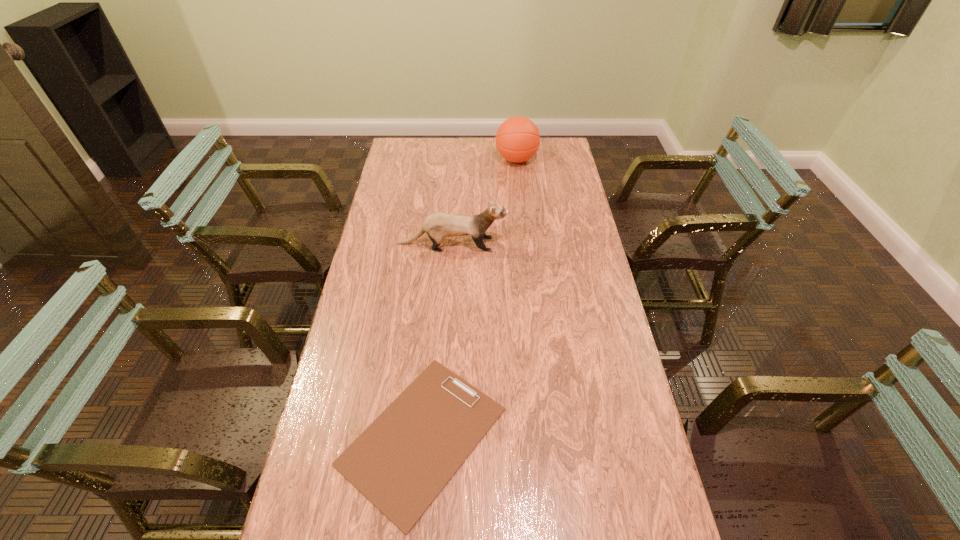
Identify the location of the farthest object. The width and height of the screenshot is (960, 540). (517, 140).

Locate an element on the screen. ferret is located at coordinates pos(438,226).

Locate an element on the screen. The width and height of the screenshot is (960, 540). the nearest object is located at coordinates (401, 462).

Locate an element on the screen. The height and width of the screenshot is (540, 960). the shortest object is located at coordinates (401, 462).

I want to click on vacant space located 0.060m on the back of the farthest object, so click(x=515, y=142).

Where is `vacant area situated 0.260m on the face of the second farthest object`? This screenshot has width=960, height=540. vacant area situated 0.260m on the face of the second farthest object is located at coordinates (578, 244).

Where is `free space located on the back of the nearest object`? Image resolution: width=960 pixels, height=540 pixels. free space located on the back of the nearest object is located at coordinates (432, 330).

Find the location of a particular element. Image resolution: width=960 pixels, height=540 pixels. object that is at the far edge is located at coordinates point(517,140).

Identify the location of ferret that is at the left edge. This screenshot has height=540, width=960. (438, 226).

At what (x,y) coordinates should I click in order to perform the action: click on clipboard that is positioned at the left edge. Please return your answer as a coordinate pair (x, y). This screenshot has width=960, height=540. Looking at the image, I should click on (401, 462).